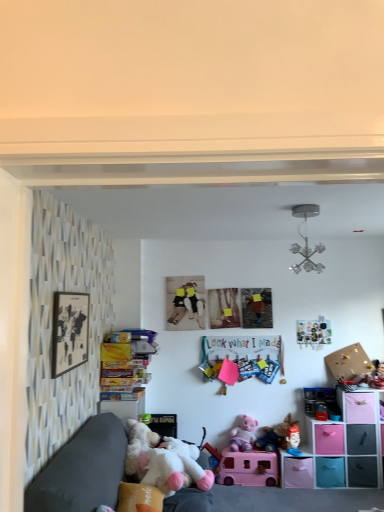
Describe the element at coordinates (243, 435) in the screenshot. I see `pink plush toy at lower center, marked as the fifth toy in a top-to-bottom arrangement` at that location.

What is the approximate width of corkboard at upper right?

It is 7.43 inches.

I want to click on pink matte toy car at center, which is the first toy in bottom-to-top order, so click(x=248, y=468).

The height and width of the screenshot is (512, 384). What do you see at coordinates (83, 470) in the screenshot?
I see `velvet grey couch at lower left` at bounding box center [83, 470].

The width and height of the screenshot is (384, 512). I want to click on pink plush toy at lower center, marked as the fifth toy in a top-to-bottom arrangement, so click(243, 435).

Considering the sizes of objects pink plush toy at lower center, placed as the 3th toy when sorted from bottom to top, and translucent plastic toy car at right, which ranks as the sixth toy in bottom-to-top order, in the image provided, who is taller, pink plush toy at lower center, placed as the 3th toy when sorted from bottom to top, or translucent plastic toy car at right, which ranks as the sixth toy in bottom-to-top order,?

Standing taller between the two is pink plush toy at lower center, placed as the 3th toy when sorted from bottom to top.

Is pink plush toy at lower center, placed as the 3th toy when sorted from bottom to top, touching translucent plastic toy car at right, which ranks as the sixth toy in bottom-to-top order?

There is a gap between pink plush toy at lower center, placed as the 3th toy when sorted from bottom to top, and translucent plastic toy car at right, which ranks as the sixth toy in bottom-to-top order.

Is translucent plastic toy car at right, which is the second toy from top to bottom, surrounded by pink plush toy at lower center, marked as the fifth toy in a top-to-bottom arrangement?

No, translucent plastic toy car at right, which is the second toy from top to bottom, is not a part of pink plush toy at lower center, marked as the fifth toy in a top-to-bottom arrangement.

You are a GUI agent. You are given a task and a screenshot of the screen. Output one action in this format:
    pyautogui.click(x=<x>, y=<y>)
    Task: Click on the studio couch that appears on the left of metallic chandelier at upper center, placed as the 1th toy when sorted from top to bottom
    
    Given the screenshot: What is the action you would take?
    pyautogui.click(x=83, y=470)

Does velvet grey couch at lower left have a lesser width compared to metallic chandelier at upper center, marked as the 7th toy in a bottom-to-top arrangement?

Incorrect, the width of velvet grey couch at lower left is not less than that of metallic chandelier at upper center, marked as the 7th toy in a bottom-to-top arrangement.

Is metallic chandelier at upper center, placed as the 1th toy when sorted from top to bottom, inside velvet grey couch at lower left?

Definitely not — metallic chandelier at upper center, placed as the 1th toy when sorted from top to bottom, is not inside velvet grey couch at lower left.

From the image's perspective, does velvet grey couch at lower left appear higher than metallic chandelier at upper center, placed as the 1th toy when sorted from top to bottom?

No, from the image's perspective, velvet grey couch at lower left is not over metallic chandelier at upper center, placed as the 1th toy when sorted from top to bottom.

Considering the sizes of objects metallic chandelier at upper center, placed as the 1th toy when sorted from top to bottom, and matte black pants at center in the image provided, who is shorter, metallic chandelier at upper center, placed as the 1th toy when sorted from top to bottom, or matte black pants at center?

metallic chandelier at upper center, placed as the 1th toy when sorted from top to bottom, is shorter.

Does metallic chandelier at upper center, marked as the 7th toy in a bottom-to-top arrangement, have a lesser width compared to matte black pants at center?

No.

Considering the positions of objects metallic chandelier at upper center, placed as the 1th toy when sorted from top to bottom, and matte black pants at center in the image provided, who is in front, metallic chandelier at upper center, placed as the 1th toy when sorted from top to bottom, or matte black pants at center?

metallic chandelier at upper center, placed as the 1th toy when sorted from top to bottom, is more forward.

The image size is (384, 512). I want to click on person lying below the metallic chandelier at upper center, placed as the 1th toy when sorted from top to bottom (from the image's perspective), so click(x=185, y=303).

Does fluffy white plush at lower left, the third toy in the top-to-bottom sequence, come behind velvet grey couch at lower left?

Yes, fluffy white plush at lower left, the third toy in the top-to-bottom sequence, is further from the camera.

Is fluffy white plush at lower left, the third toy in the top-to-bottom sequence, facing away from velvet grey couch at lower left?

Yes, fluffy white plush at lower left, the third toy in the top-to-bottom sequence, is positioned with its back facing velvet grey couch at lower left.

Are fluffy white plush at lower left, the third toy in the top-to-bottom sequence, and velvet grey couch at lower left far apart?

fluffy white plush at lower left, the third toy in the top-to-bottom sequence, is actually quite close to velvet grey couch at lower left.

From the image's perspective, is fluffy white plush at lower left, arranged as the 5th toy when ordered from the bottom, located beneath velvet grey couch at lower left?

No, from the image's perspective, fluffy white plush at lower left, arranged as the 5th toy when ordered from the bottom, is not beneath velvet grey couch at lower left.

Considering the sizes of objects pink plush toy at lower center, placed as the 3th toy when sorted from bottom to top, and matte black picture frame at left in the image provided, who is smaller, pink plush toy at lower center, placed as the 3th toy when sorted from bottom to top, or matte black picture frame at left?

matte black picture frame at left is smaller.

Is pink plush toy at lower center, placed as the 3th toy when sorted from bottom to top, looking in the opposite direction of matte black picture frame at left?

No.

Considering the sizes of objects pink plush toy at lower center, marked as the fifth toy in a top-to-bottom arrangement, and matte black picture frame at left in the image provided, who is thinner, pink plush toy at lower center, marked as the fifth toy in a top-to-bottom arrangement, or matte black picture frame at left?

matte black picture frame at left is thinner.

From a real-world perspective, which is physically below, pink plush toy at lower center, placed as the 3th toy when sorted from bottom to top, or matte black picture frame at left?

From a 3D spatial view, pink plush toy at lower center, placed as the 3th toy when sorted from bottom to top, is below.

Does pink matte toy car at center, the 7th toy positioned from the top, turn towards metallic chandelier at upper center, placed as the 1th toy when sorted from top to bottom?

No.

Which point is more forward, (244, 459) or (302, 216)?

The point (302, 216) is closer to the camera.

From a real-world perspective, which is physically above, pink matte toy car at center, which is the first toy in bottom-to-top order, or metallic chandelier at upper center, marked as the 7th toy in a bottom-to-top arrangement?

metallic chandelier at upper center, marked as the 7th toy in a bottom-to-top arrangement.

Looking at this image, considering the sizes of matte black pants at center and pink plush toy at lower center, the fourth toy viewed from the top, in the image, is matte black pants at center taller or shorter than pink plush toy at lower center, the fourth toy viewed from the top,?

matte black pants at center is taller than pink plush toy at lower center, the fourth toy viewed from the top.

Considering their positions, is matte black pants at center located in front of or behind pink plush toy at lower center, which is counted as the fourth toy, starting from the bottom?

matte black pants at center is behind pink plush toy at lower center, which is counted as the fourth toy, starting from the bottom.

Is pink plush toy at lower center, which is counted as the fourth toy, starting from the bottom, at the back of matte black pants at center?

No, matte black pants at center is not facing the opposite direction of pink plush toy at lower center, which is counted as the fourth toy, starting from the bottom.

From a real-world perspective, which is physically below, matte black pants at center or pink plush toy at lower center, the fourth toy viewed from the top?

pink plush toy at lower center, the fourth toy viewed from the top.

The height and width of the screenshot is (512, 384). In order to click on the 5th toy to the right of the pink plush toy at lower center, marked as the fifth toy in a top-to-bottom arrangement, counting from the anchor's position in this screenshot , I will do `click(320, 400)`.

Where is `the 3rd toy above the velvet grey couch at lower left (from the image's perspective)`? The image size is (384, 512). the 3rd toy above the velvet grey couch at lower left (from the image's perspective) is located at coordinates (307, 256).

Based on the photo, based on their spatial positions, is matte black pants at center or velvet grey couch at lower left further from matte black picture frame at left?

Based on the image, matte black pants at center appears to be further to matte black picture frame at left.

Which object lies nearer to the anchor point fluffy white plush at lower left, arranged as the 5th toy when ordered from the bottom, pink plastic storage cubes at lower right or matte black pants at center?

matte black pants at center.

Which object lies further to the anchor point plush fabric toy at lower right, the 6th toy viewed from the top, pink plush toy at lower center, which is counted as the fourth toy, starting from the bottom, or velvet grey couch at lower left?

velvet grey couch at lower left lies further to plush fabric toy at lower right, the 6th toy viewed from the top, than the other object.

Considering their positions, is matte black picture frame at left positioned closer to pink plush toy at lower center, placed as the 3th toy when sorted from bottom to top, than pink matte toy car at center, the 7th toy positioned from the top?

The object closer to pink plush toy at lower center, placed as the 3th toy when sorted from bottom to top, is pink matte toy car at center, the 7th toy positioned from the top.

From the image, which object appears to be nearer to plush fabric toy at lower right, the 6th toy viewed from the top, corkboard at upper right or matte black pants at center?

corkboard at upper right lies closer to plush fabric toy at lower right, the 6th toy viewed from the top, than the other object.

Which object lies further to the anchor point fluffy white plush at lower left, the third toy in the top-to-bottom sequence, pink plush toy at lower center, the fourth toy viewed from the top, or matte black picture frame at left?

pink plush toy at lower center, the fourth toy viewed from the top, lies further to fluffy white plush at lower left, the third toy in the top-to-bottom sequence, than the other object.

Estimate the real-world distances between objects in this image. Which object is further from translucent plastic toy car at right, which ranks as the sixth toy in bottom-to-top order, plush fabric toy at lower right, the 6th toy viewed from the top, or metallic chandelier at upper center, marked as the 7th toy in a bottom-to-top arrangement?

metallic chandelier at upper center, marked as the 7th toy in a bottom-to-top arrangement.

Estimate the real-world distances between objects in this image. Which object is closer to translucent plastic toy car at right, which is the second toy from top to bottom, corkboard at upper right or pink plush toy at lower center, which is counted as the fourth toy, starting from the bottom?

Among the two, corkboard at upper right is located nearer to translucent plastic toy car at right, which is the second toy from top to bottom.

Find the location of a particular element. The height and width of the screenshot is (512, 384). shelf between pink matte toy car at center, the 7th toy positioned from the top, and corkboard at upper right, in the horizontal direction is located at coordinates (342, 446).

Identify the location of picture frame between velvet grey couch at lower left and matte black pants at center along the z-axis. (70, 331).

Identify the location of cardboard box that lies between metallic chandelier at upper center, placed as the 1th toy when sorted from top to bottom, and translucent plastic toy car at right, which is the second toy from top to bottom, from top to bottom. Image resolution: width=384 pixels, height=512 pixels. (349, 362).

Where is `shelf located between velvet grey couch at lower left and plush fabric toy at lower right, which ranks as the 2th toy in bottom-to-top order, in the depth direction`? shelf located between velvet grey couch at lower left and plush fabric toy at lower right, which ranks as the 2th toy in bottom-to-top order, in the depth direction is located at coordinates (342, 446).